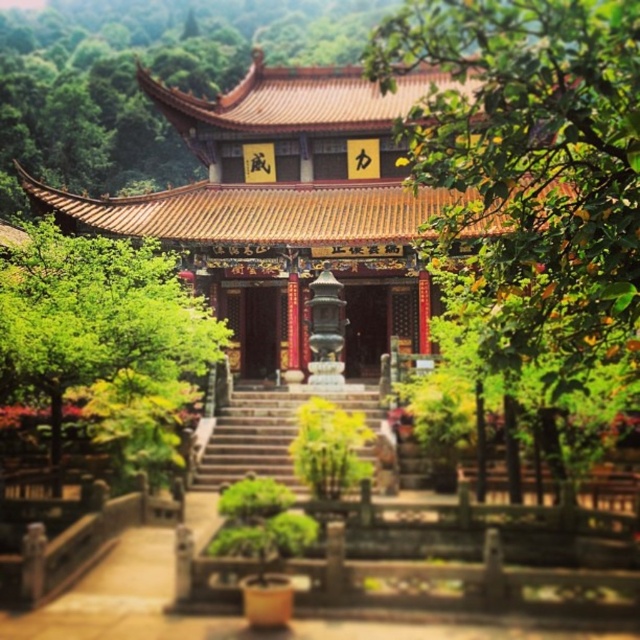
You are an architect planning to take a photo of the shiny gold roof at center and the green leafy tree at left. To ensure both fit in the frame, you need to know which one is wider. Which object has a greater width?

The shiny gold roof at center has a greater width than the green leafy tree at left according to the description.